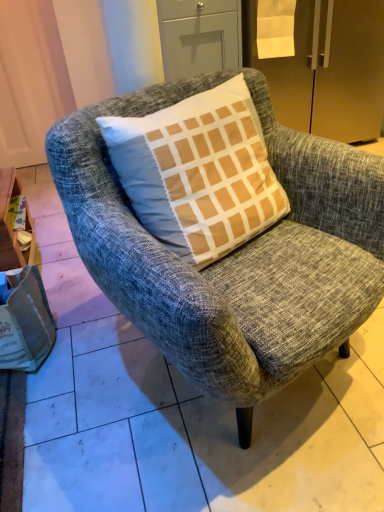
Locate an element on the screen. This screenshot has width=384, height=512. vacant region in front of white paper bag at lower left is located at coordinates pyautogui.click(x=35, y=414).